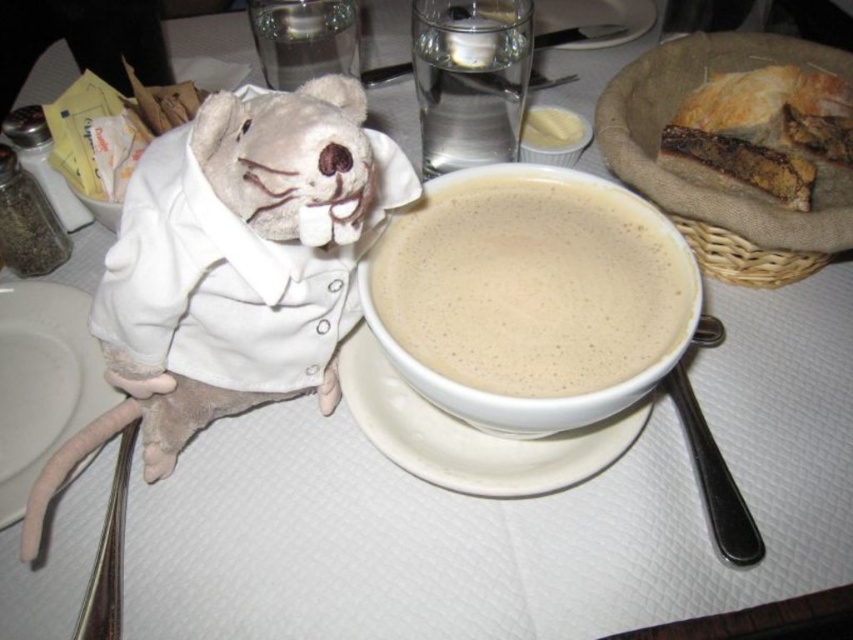
In the scene shown: Does fuzzy plush toy at upper left lie in front of white ceramic saucer at center?

Yes, it is.

Which is more to the left, fuzzy plush toy at upper left or white ceramic saucer at center?

Positioned to the left is fuzzy plush toy at upper left.

Who is more distant from viewer, (229, 412) or (579, 458)?

The point (229, 412) is more distant.

Find the location of a particular element. fuzzy plush toy at upper left is located at coordinates (233, 268).

Which is more to the right, white matte soup at center or buttery white bread at upper right?

buttery white bread at upper right

Where is `white matte soup at center`? white matte soup at center is located at coordinates (537, 397).

Who is more distant from viewer, (264, 221) or (529, 120)?

The point (529, 120) is more distant.

Is fuzzy plush toy at upper left smaller than buttery white bread at upper right?

Incorrect, fuzzy plush toy at upper left is not smaller in size than buttery white bread at upper right.

Locate an element on the screen. fuzzy plush toy at upper left is located at coordinates (233, 268).